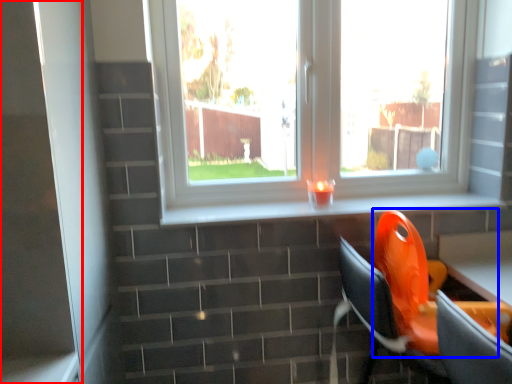
Question: Among these objects, which one is nearest to the camera, screen door (highlighted by a red box) or swivel chair (highlighted by a blue box)?

Choices:
 (A) screen door
 (B) swivel chair

Answer: (A)